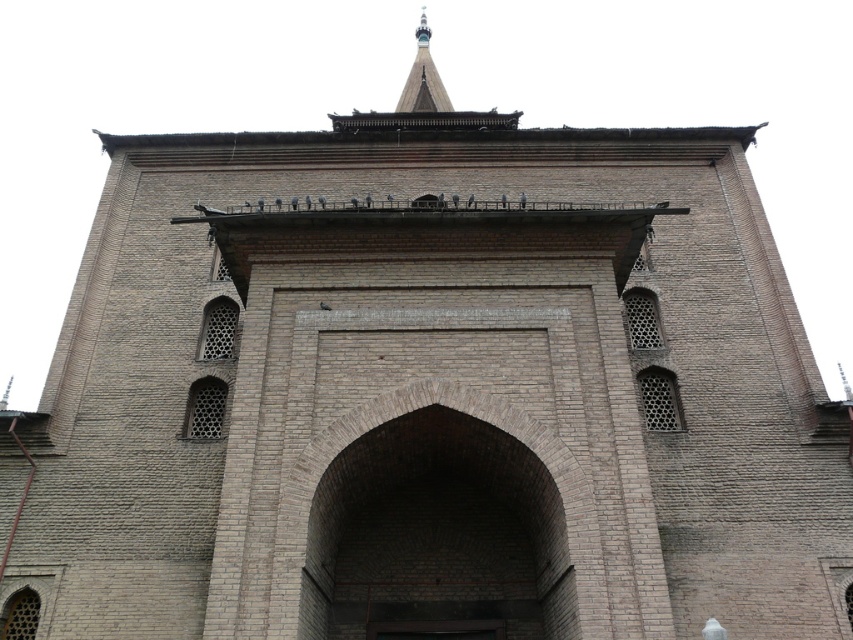
Is brick archway at center shorter than shiny silver spire at upper center?

Correct, brick archway at center is not as tall as shiny silver spire at upper center.

Which is in front, point (364, 547) or point (434, 106)?

Point (364, 547) is in front.

This screenshot has width=853, height=640. What are the coordinates of `brick archway at center` in the screenshot? It's located at tap(436, 536).